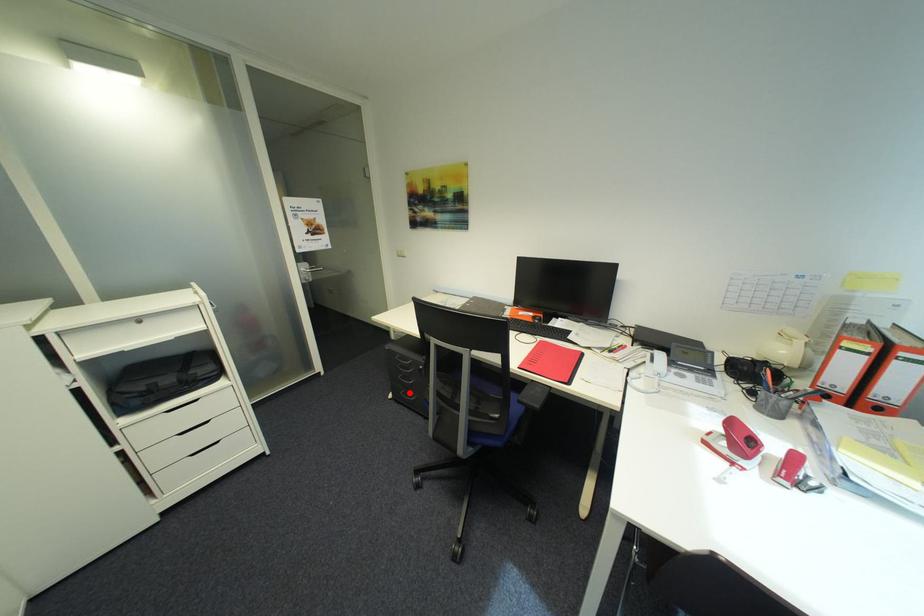
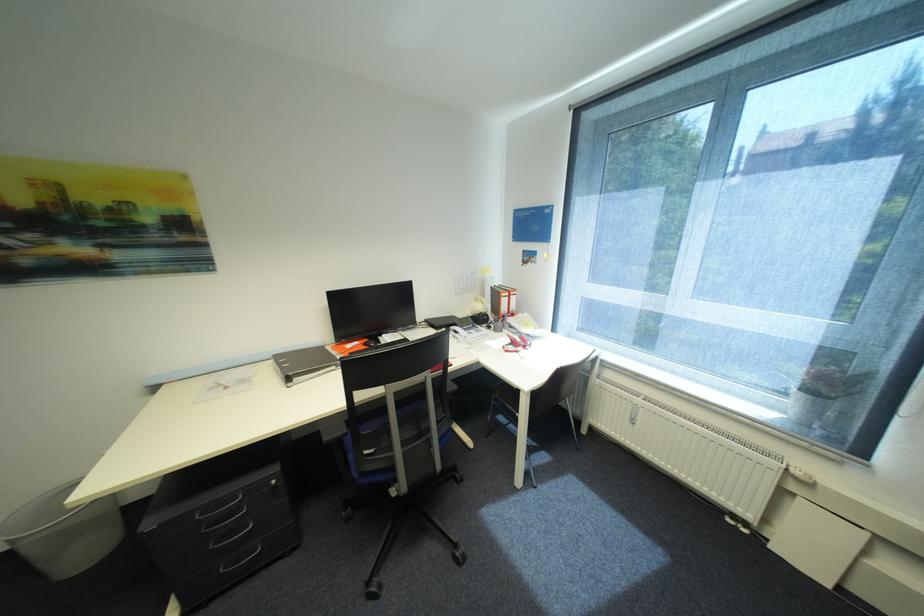
Question: I am providing you with two images of the same scene from different viewpoints. A red point is shown in image1. For the corresponding object point in image2, is it positioned nearer or farther from the camera?

Choices:
 (A) Nearer
 (B) Farther

Answer: (A)